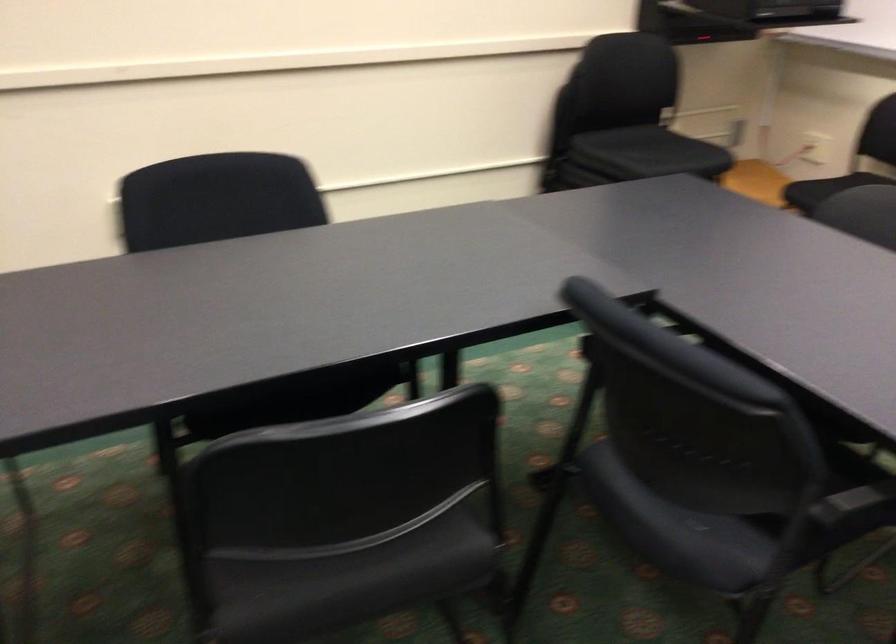
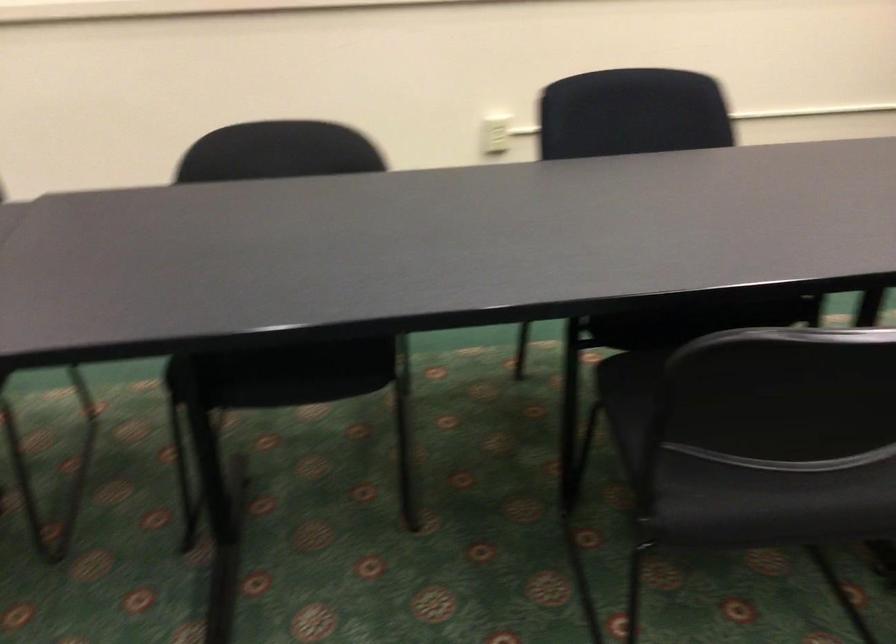
Question: The camera is either moving clockwise (left) or counter-clockwise (right) around the object. The first image is from the beginning of the video and the second image is from the end. Is the camera moving left or right when shooting the video?

Choices:
 (A) Left
 (B) Right

Answer: (B)